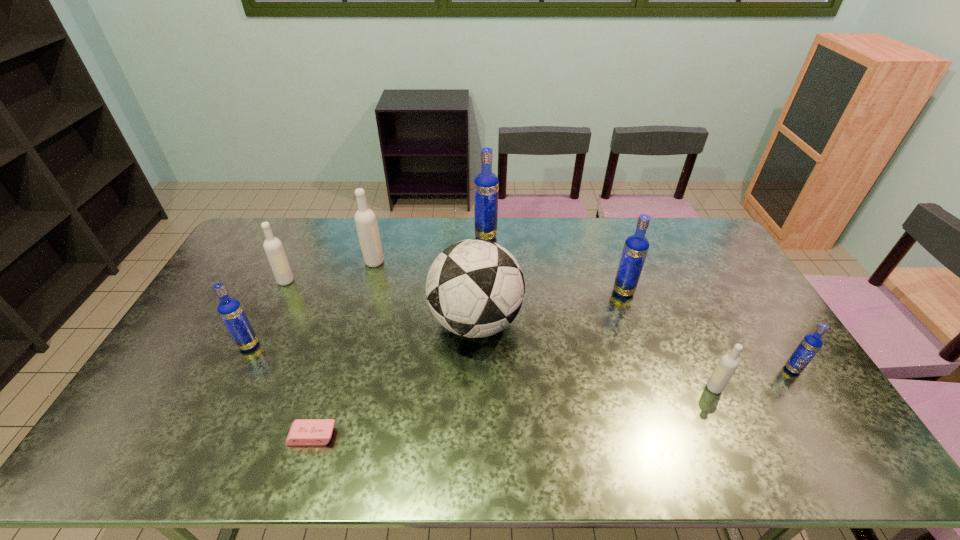
Where is `free location that satisfies the following two spatial constraints: 1. on the back side of the fourth vodka from left to right; 2. on the right side of the shortest object`? The image size is (960, 540). free location that satisfies the following two spatial constraints: 1. on the back side of the fourth vodka from left to right; 2. on the right side of the shortest object is located at coordinates 372,237.

This screenshot has width=960, height=540. What are the coordinates of `vacant space that satisfies the following two spatial constraints: 1. on the back side of the second farthest white vodka; 2. on the right side of the tallest vodka` in the screenshot? It's located at (307, 237).

Where is `vacant space that satisfies the following two spatial constraints: 1. on the back side of the rightmost white vodka; 2. on the right side of the rightmost vodka`? vacant space that satisfies the following two spatial constraints: 1. on the back side of the rightmost white vodka; 2. on the right side of the rightmost vodka is located at coordinates (706, 369).

Where is `vacant space that satisfies the following two spatial constraints: 1. on the front side of the nearest object; 2. on the left side of the leftmost blue vodka`? vacant space that satisfies the following two spatial constraints: 1. on the front side of the nearest object; 2. on the left side of the leftmost blue vodka is located at coordinates (204, 436).